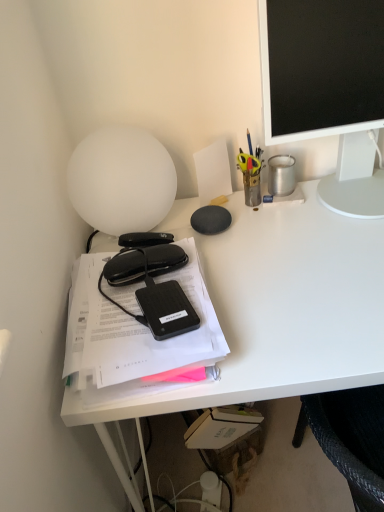
The width and height of the screenshot is (384, 512). Identify the location of free point to the right of metallic pen holder at upper right, the third stationery positioned from the left. (324, 201).